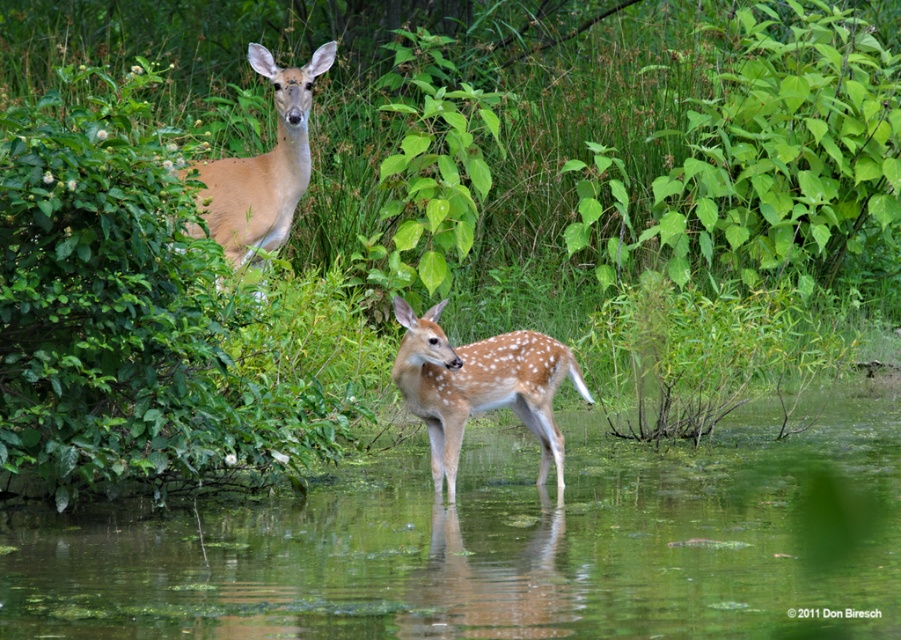
You are standing in the scene and want to reach the two points marked in the image. Which point, point (617, 486) or point (261, 70), is closer to you?

Point (617, 486) is closer to the viewer than point (261, 70).